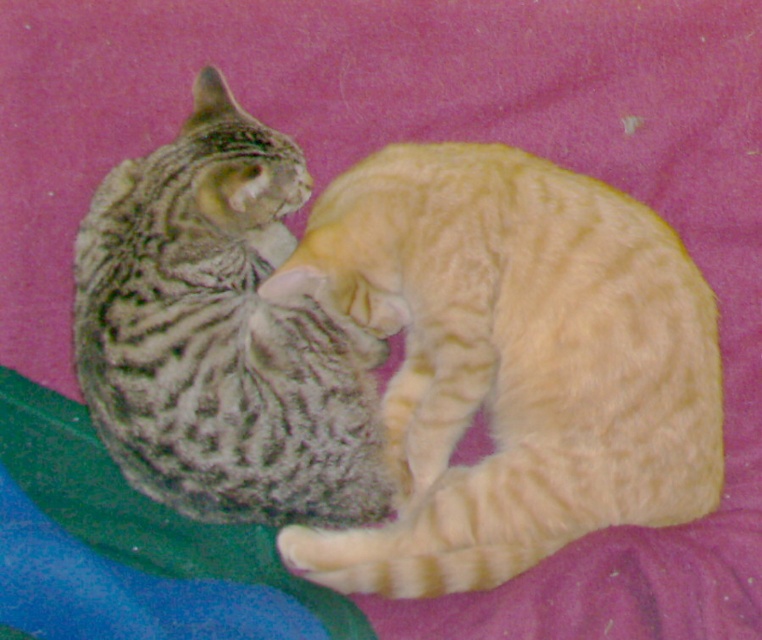
You are a photographer trying to capture a closeup of the orange tabby cat at center. You notice a point marked at coordinates point (511,362). Can you confirm if this point is located on the orange tabby cat at center?

Yes, the point (511,362) corresponds to the orange tabby cat at center, so it is located on the orange tabey cat at center.